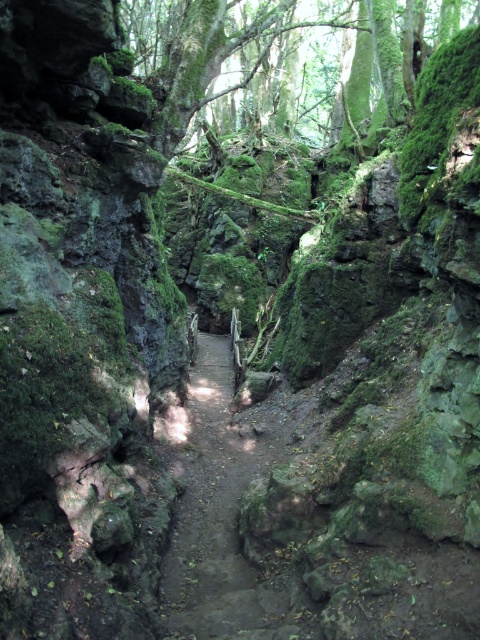
In the scene shown: Between dirt path at center and green mossy tree at upper center, which one is positioned higher?

green mossy tree at upper center

Is dirt path at center smaller than green mossy tree at upper center?

Yes, dirt path at center is smaller than green mossy tree at upper center.

Identify the location of dirt path at center. (228, 506).